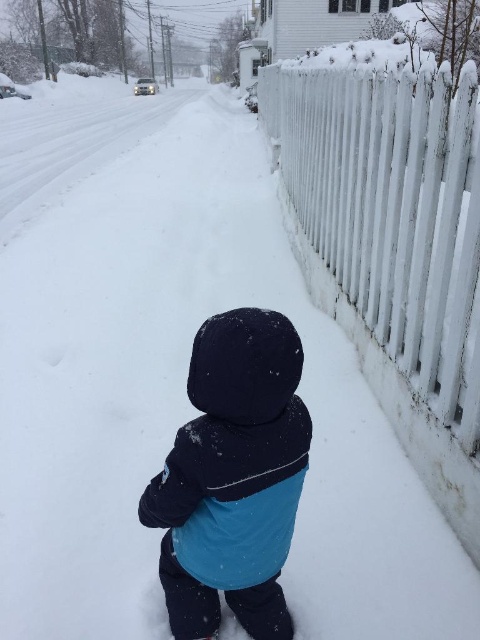
Question: Among these points, which one is farthest from the camera?

Choices:
 (A) (386, 124)
 (B) (194, 392)

Answer: (A)

Question: Is white painted wood fence at right bigger than blue fleece jacket at center?

Choices:
 (A) yes
 (B) no

Answer: (B)

Question: Which object appears farthest from the camera in this image?

Choices:
 (A) blue fleece jacket at center
 (B) white painted wood fence at right

Answer: (B)

Question: Which of the following is the farthest from the observer?

Choices:
 (A) (430, 243)
 (B) (204, 465)

Answer: (A)

Question: Considering the relative positions of white painted wood fence at right and blue fleece jacket at center in the image provided, where is white painted wood fence at right located with respect to blue fleece jacket at center?

Choices:
 (A) right
 (B) left

Answer: (A)

Question: Can you confirm if white painted wood fence at right is bigger than blue fleece jacket at center?

Choices:
 (A) no
 (B) yes

Answer: (A)